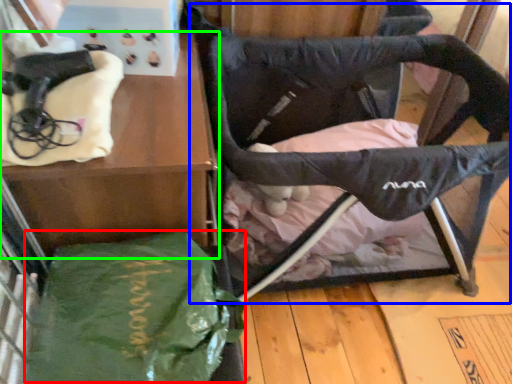
Question: Considering the real-world distances, which object is closest to tote bag (highlighted by a red box)? swivel chair (highlighted by a blue box) or furniture (highlighted by a green box).

Choices:
 (A) swivel chair
 (B) furniture

Answer: (B)